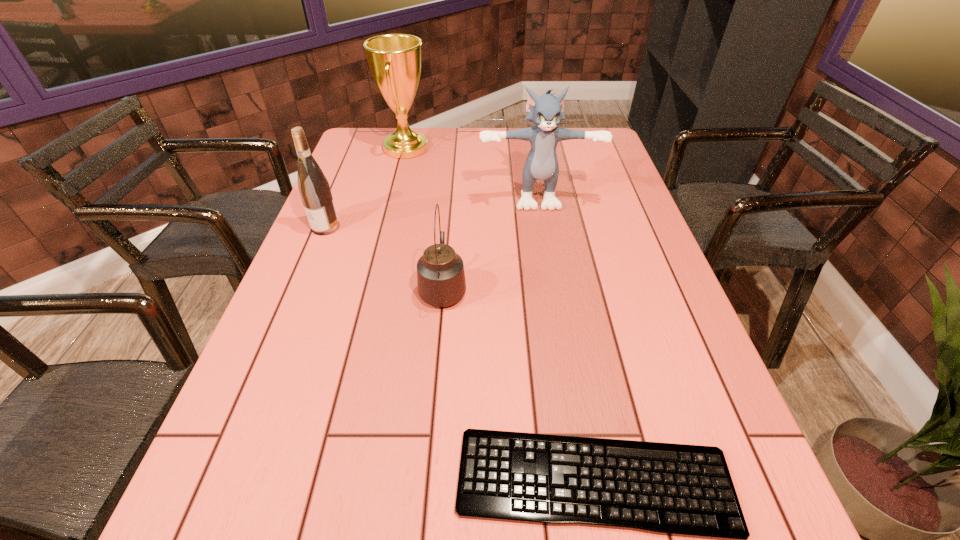
Where is `blank area at the left edge`? blank area at the left edge is located at coordinates (346, 161).

I want to click on vacant space at the right edge of the desktop, so click(594, 185).

In the image, there is a desktop. Where is `vacant space at the far left corner`? This screenshot has width=960, height=540. vacant space at the far left corner is located at coordinates (373, 141).

In the image, there is a desktop. Identify the location of vacant space at the far right corner. (578, 143).

This screenshot has width=960, height=540. I want to click on unoccupied position between the leftmost object and the award, so click(x=366, y=188).

Identify the location of vacant space in between the wine bottle and the award. This screenshot has width=960, height=540. (366, 188).

Where is `free space that is in between the second nearest object and the wine bottle`? The image size is (960, 540). free space that is in between the second nearest object and the wine bottle is located at coordinates (384, 257).

The image size is (960, 540). Identify the location of free space that is in between the fourth farthest object and the cat. pos(490,241).

The image size is (960, 540). I want to click on vacant space that is in between the leftmost object and the cat, so click(431, 211).

In order to click on free point between the kettle and the cat in this screenshot , I will do `click(490, 241)`.